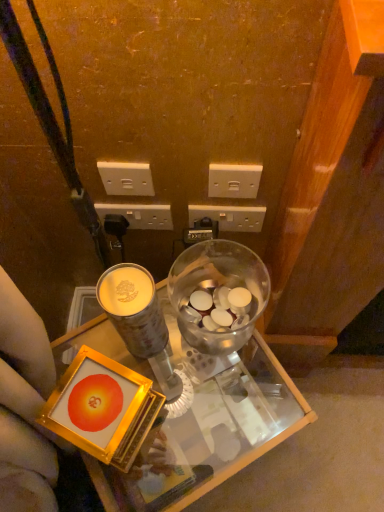
How much space does white plastic power outlet at center, the 2th power outlet viewed from the left, occupy vertically?

3.58 inches.

In order to face white plastic power outlet at upper center, placed as the 4th power outlet when sorted from right to left, should I rotate leftwards or rightwards?

You should rotate left by 8.967 degrees.

The image size is (384, 512). Describe the element at coordinates (230, 217) in the screenshot. I see `white plastic power outlet at center, which is the third power outlet from left to right` at that location.

You are a GUI agent. You are given a task and a screenshot of the screen. Output one action in this format:
    pyautogui.click(x=<x>, y=<y>)
    Task: Click on the white plastic power outlet at center, the 2th power outlet viewed from the left
    
    Given the screenshot: What is the action you would take?
    pyautogui.click(x=139, y=215)

Would you say transparent glass desk at center contains translucent glass jar at center?

Actually, translucent glass jar at center is outside transparent glass desk at center.

The height and width of the screenshot is (512, 384). I want to click on desk below the translucent glass jar at center (from the image's perspective), so click(206, 426).

Is transparent glass desk at center facing towards translucent glass jar at center?

No, transparent glass desk at center does not turn towards translucent glass jar at center.

Which object is closer to the camera taking this photo, matte gold coffee cup at center or transparent glass desk at center?

matte gold coffee cup at center is more forward.

Does matte gold coffee cup at center have a smaller size compared to transparent glass desk at center?

Yes.

What's the angular difference between matte gold coffee cup at center and transparent glass desk at center's facing directions?

There is a 32.2-degree angle between the facing directions of matte gold coffee cup at center and transparent glass desk at center.

Is matte gold coffee cup at center thinner than transparent glass desk at center?

Yes.

Are translucent glass jar at center and white plastic power outlet at center, which is the third power outlet from left to right, making contact?

No, translucent glass jar at center is not beside white plastic power outlet at center, which is the third power outlet from left to right.

Who is taller, translucent glass jar at center or white plastic power outlet at center, the second power outlet from the right?

With more height is translucent glass jar at center.

From a real-world perspective, is translucent glass jar at center positioned above or below white plastic power outlet at center, the second power outlet from the right?

Clearly, from a real-world perspective, translucent glass jar at center is above white plastic power outlet at center, the second power outlet from the right.

Is point (231, 255) closer to viewer compared to point (201, 217)?

Yes, it is in front of point (201, 217).

From the image's perspective, does white plastic power outlet at center, the third power outlet positioned from the right, appear lower than transparent glass desk at center?

Actually, white plastic power outlet at center, the third power outlet positioned from the right, appears above transparent glass desk at center in the image.

Based on the photo, can you confirm if white plastic power outlet at center, the third power outlet positioned from the right, is shorter than transparent glass desk at center?

Yes, white plastic power outlet at center, the third power outlet positioned from the right, is shorter than transparent glass desk at center.

Image resolution: width=384 pixels, height=512 pixels. What are the coordinates of `desk to the right of white plastic power outlet at center, the third power outlet positioned from the right` in the screenshot? It's located at (206, 426).

Is white plastic power outlet at center, the second power outlet from the right, turned away from matte gold coffee cup at center?

No, white plastic power outlet at center, the second power outlet from the right,'s orientation is not away from matte gold coffee cup at center.

Which is farther, (252, 226) or (127, 268)?

The point (252, 226) is farther from the camera.

Which object is positioned more to the left, white plastic power outlet at center, which is the third power outlet from left to right, or matte gold coffee cup at center?

From the viewer's perspective, matte gold coffee cup at center appears more on the left side.

From a real-world perspective, between white plastic power outlet at center, the second power outlet from the right, and matte gold coffee cup at center, who is vertically higher?

matte gold coffee cup at center, from a real-world perspective.

Considering the relative positions of white plastic power outlet at center, the third power outlet positioned from the right, and matte gold coffee cup at center in the image provided, is white plastic power outlet at center, the third power outlet positioned from the right, to the right of matte gold coffee cup at center from the viewer's perspective?

No, white plastic power outlet at center, the third power outlet positioned from the right, is not to the right of matte gold coffee cup at center.

Can you confirm if white plastic power outlet at center, the 2th power outlet viewed from the left, is shorter than matte gold coffee cup at center?

Yes, white plastic power outlet at center, the 2th power outlet viewed from the left, is shorter than matte gold coffee cup at center.

Could you tell me if white plastic power outlet at center, the 2th power outlet viewed from the left, is turned towards matte gold coffee cup at center?

Yes, white plastic power outlet at center, the 2th power outlet viewed from the left, is oriented towards matte gold coffee cup at center.

Is transparent glass desk at center touching white plastic power outlet at upper center, placed as the 4th power outlet when sorted from right to left?

They are not placed beside each other.

From the image's perspective, between transparent glass desk at center and white plastic power outlet at upper center, placed as the 4th power outlet when sorted from right to left, who is located below?

transparent glass desk at center appears lower in the image.

Considering the sizes of objects transparent glass desk at center and white plastic power outlet at upper center, placed as the 4th power outlet when sorted from right to left, in the image provided, who is taller, transparent glass desk at center or white plastic power outlet at upper center, placed as the 4th power outlet when sorted from right to left,?

With more height is transparent glass desk at center.

Is transparent glass desk at center oriented away from white plastic power outlet at upper center, placed as the 4th power outlet when sorted from right to left?

No, transparent glass desk at center is not facing away from white plastic power outlet at upper center, placed as the 4th power outlet when sorted from right to left.

Find the location of `desk on the left of the translucent glass jar at center`. desk on the left of the translucent glass jar at center is located at coordinates (206, 426).

This screenshot has width=384, height=512. In order to click on desk below the matte gold coffee cup at center (from the image's perspective) in this screenshot , I will do `click(206, 426)`.

When comparing their distances from transparent glass desk at center, does white plastic power outlet at center, the second power outlet from the right, or white plastic power outlet at upper center, the 1th power outlet viewed from the right, seem closer?

The object closer to transparent glass desk at center is white plastic power outlet at center, the second power outlet from the right.

Based on their spatial positions, is white plastic power outlet at upper center, placed as the 4th power outlet when sorted from right to left, or white plastic power outlet at upper center, the 1th power outlet viewed from the right, further from white plastic power outlet at center, the second power outlet from the right?

white plastic power outlet at upper center, placed as the 4th power outlet when sorted from right to left, is further to white plastic power outlet at center, the second power outlet from the right.

Which object lies further to the anchor point transparent glass desk at center, translucent glass jar at center or matte gold coffee cup at center?

matte gold coffee cup at center is positioned further to the anchor transparent glass desk at center.

Looking at the image, which one is located further to white plastic power outlet at center, the third power outlet positioned from the right, white plastic power outlet at upper center, marked as the 1th power outlet in a left-to-right arrangement, or white plastic power outlet at upper center, acting as the fourth power outlet starting from the left?

white plastic power outlet at upper center, acting as the fourth power outlet starting from the left, lies further to white plastic power outlet at center, the third power outlet positioned from the right, than the other object.

Estimate the real-world distances between objects in this image. Which object is further from matte gold coffee cup at center, white plastic power outlet at upper center, the 1th power outlet viewed from the right, or white plastic power outlet at upper center, marked as the 1th power outlet in a left-to-right arrangement?

Among the two, white plastic power outlet at upper center, the 1th power outlet viewed from the right, is located further to matte gold coffee cup at center.

Considering their positions, is white plastic power outlet at upper center, acting as the fourth power outlet starting from the left, positioned closer to white plastic power outlet at upper center, placed as the 4th power outlet when sorted from right to left, than white plastic power outlet at center, the third power outlet positioned from the right?

white plastic power outlet at center, the third power outlet positioned from the right.

From the image, which object appears to be nearer to transparent glass desk at center, white plastic power outlet at upper center, placed as the 4th power outlet when sorted from right to left, or matte gold coffee cup at center?

matte gold coffee cup at center is positioned closer to the anchor transparent glass desk at center.

From the image, which object appears to be nearer to matte gold coffee cup at center, white plastic power outlet at center, the 2th power outlet viewed from the left, or white plastic power outlet at upper center, placed as the 4th power outlet when sorted from right to left?

Based on the image, white plastic power outlet at upper center, placed as the 4th power outlet when sorted from right to left, appears to be nearer to matte gold coffee cup at center.

Identify the location of tableware that lies between white plastic power outlet at center, which is the third power outlet from left to right, and transparent glass desk at center from top to bottom. (215, 288).

You are a GUI agent. You are given a task and a screenshot of the screen. Output one action in this format:
    pyautogui.click(x=<x>, y=<y>)
    Task: Click on the coffee cup that lies between white plastic power outlet at upper center, marked as the 1th power outlet in a left-to-right arrangement, and transparent glass desk at center from top to bottom
    Image resolution: width=384 pixels, height=512 pixels.
    Given the screenshot: What is the action you would take?
    pyautogui.click(x=133, y=308)

Find the location of a particular element. tableware between white plastic power outlet at upper center, acting as the fourth power outlet starting from the left, and transparent glass desk at center vertically is located at coordinates (215, 288).

This screenshot has width=384, height=512. Find the location of `coffee cup that lies between white plastic power outlet at center, which is the third power outlet from left to right, and transparent glass desk at center from top to bottom`. coffee cup that lies between white plastic power outlet at center, which is the third power outlet from left to right, and transparent glass desk at center from top to bottom is located at coordinates 133,308.